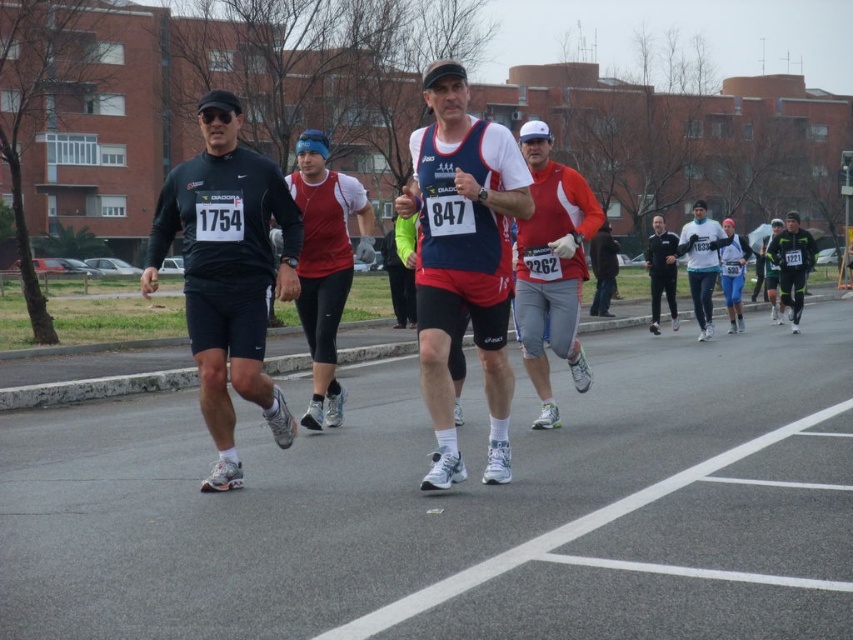
Question: Does matte blue tank top at center appear over matte black jacket at center?

Choices:
 (A) no
 (B) yes

Answer: (A)

Question: Which object appears farthest from the camera in this image?

Choices:
 (A) matte blue tank top at center
 (B) matte red shirt at center
 (C) red matte running top at center
 (D) matte black jacket at center

Answer: (D)

Question: Is matte red shirt at center closer to the viewer compared to matte black jacket at center?

Choices:
 (A) yes
 (B) no

Answer: (A)

Question: Which point is closer to the camera?

Choices:
 (A) (294, 198)
 (B) (659, 221)

Answer: (A)

Question: Which point is farther from the camera taking this photo?

Choices:
 (A) (428, 128)
 (B) (518, 305)

Answer: (B)

Question: Is matte red shirt at center positioned behind matte black jacket at center?

Choices:
 (A) yes
 (B) no

Answer: (B)